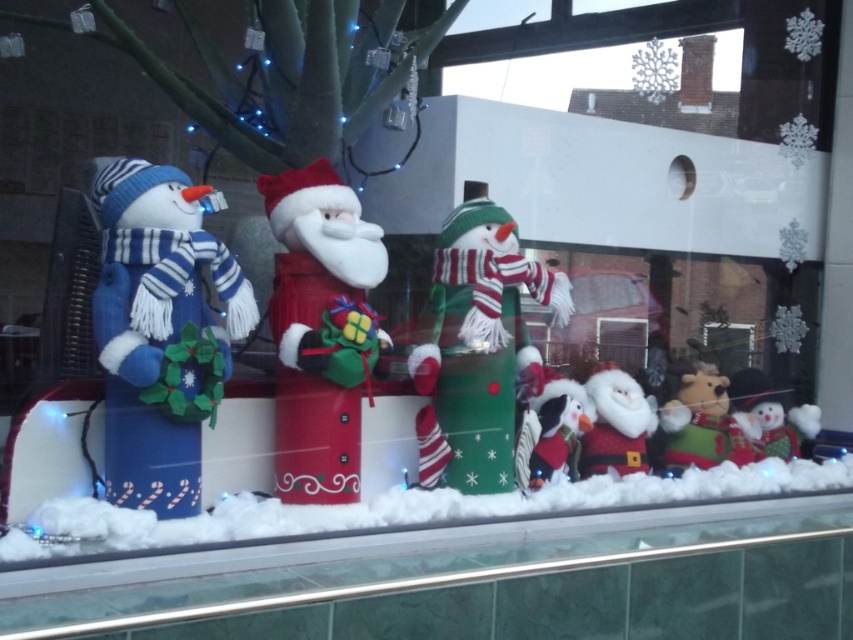
Can you confirm if green fabric snowman at center is shorter than white plush santa at center?

In fact, green fabric snowman at center may be taller than white plush santa at center.

Can you confirm if green fabric snowman at center is smaller than white plush santa at center?

Incorrect, green fabric snowman at center is not smaller in size than white plush santa at center.

Measure the distance between green fabric snowman at center and camera.

A distance of 2.30 meters exists between green fabric snowman at center and camera.

Where is `green fabric snowman at center`? This screenshot has height=640, width=853. green fabric snowman at center is located at coordinates (479, 349).

Between point (281, 200) and point (686, 403), which one is positioned in front?

Point (281, 200)

Who is more distant from viewer, (318, 161) or (694, 440)?

Point (694, 440)

The height and width of the screenshot is (640, 853). What are the coordinates of `velvet red santa at center` in the screenshot? It's located at (318, 330).

Is green fabric snowman at center smaller than velvet red santa at center?

Actually, green fabric snowman at center might be larger than velvet red santa at center.

Locate an element on the screen. This screenshot has width=853, height=640. green fabric snowman at center is located at coordinates (479, 349).

Which is in front, point (527, 339) or point (343, 225)?

Point (343, 225) is in front.

This screenshot has width=853, height=640. What are the coordinates of `green fabric snowman at center` in the screenshot? It's located at (479, 349).